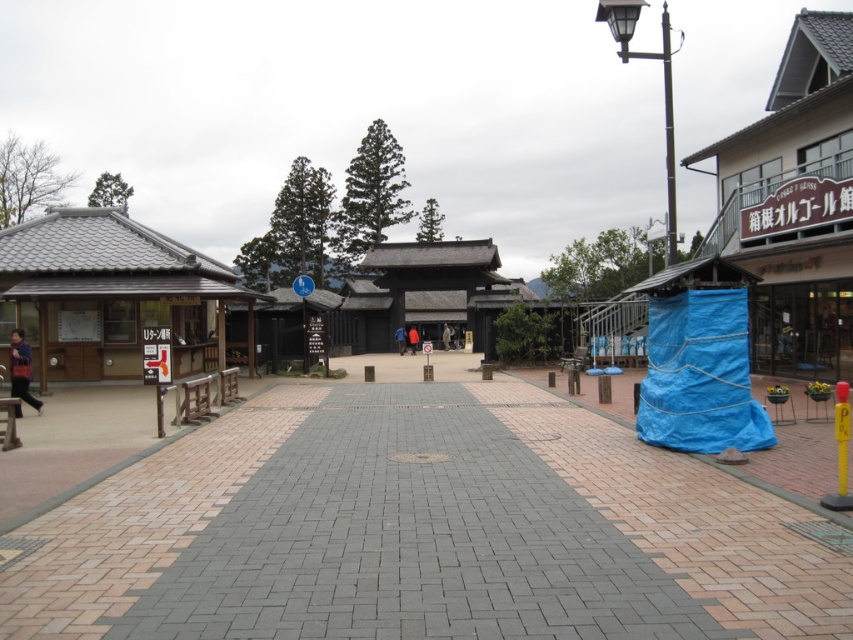
Who is more distant from viewer, [547,452] or [184,266]?

Point [184,266]

Consider the image. How far apart are brick paved walkway at center and wooden signboard at left?

brick paved walkway at center and wooden signboard at left are 10.41 meters apart.

Who is more distant from viewer, (x=540, y=627) or (x=82, y=273)?

The point (x=82, y=273) is more distant.

At what (x,y) coordinates should I click in order to perform the action: click on brick paved walkway at center. Please return your answer as a coordinate pair (x, y). The image size is (853, 640). Looking at the image, I should click on (424, 531).